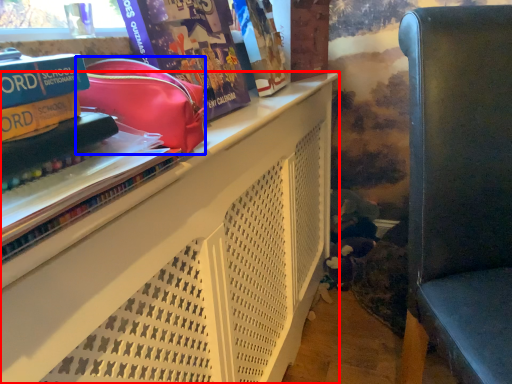
Question: Among these objects, which one is farthest to the camera, shelf (highlighted by a red box) or bag (highlighted by a blue box)?

Choices:
 (A) shelf
 (B) bag

Answer: (B)